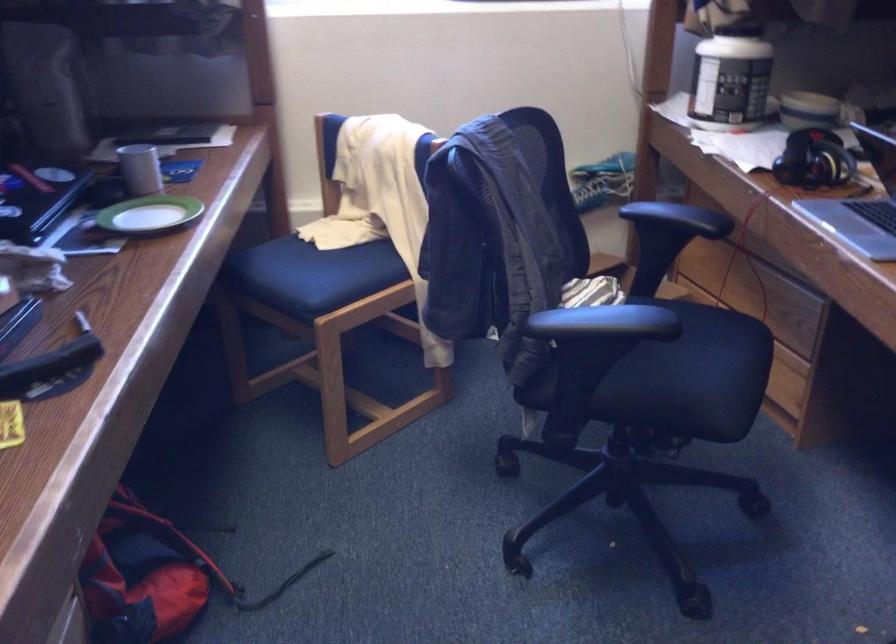
Question: The camera is either moving clockwise (left) or counter-clockwise (right) around the object. The first image is from the beginning of the video and the second image is from the end. Is the camera moving left or right when shooting the video?

Choices:
 (A) Left
 (B) Right

Answer: (A)